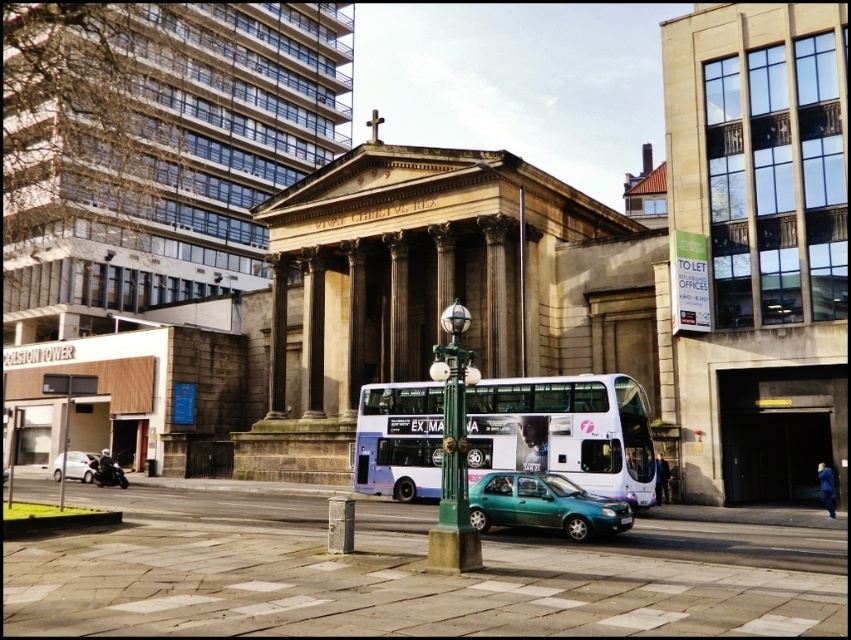
You are a pedestrian standing on the sidewalk and looking at the blue metallic bus at center and the teal matte hatchback at center. Which vehicle is positioned higher relative to the other?

The blue metallic bus at center is positioned higher than the teal matte hatchback at center.

You are a photographer standing at the edge of the street. You want to take a photo that includes both the green polished metal streetlight at center and the silver metallic car at lower left. Which object should you position closer to the front of your photo frame to ensure both are in focus?

To ensure both the green polished metal streetlight at center and the silver metallic car at lower left are in focus, position the green polished metal streetlight at center closer to the front of the photo frame since it is closer to the viewer than the silver metallic car at lower left. This way, the depth of field will cover both objects effectively.

You are a pedestrian standing on the sidewalk in front of the classical building. You see the blue metallic bus at center and the teal matte hatchback at center. Which vehicle is nearer to you?

The blue metallic bus at center is closer to the viewer than the teal matte hatchback at center, so the blue metallic bus at center is nearer to you.